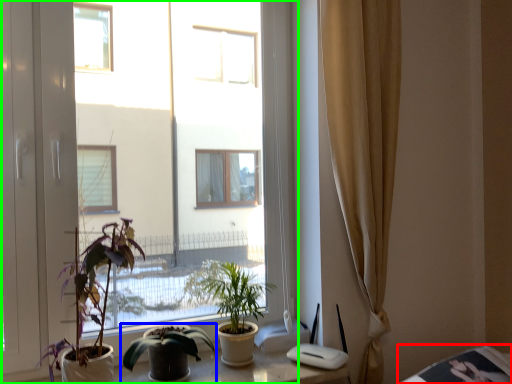
Question: Which object is positioned closest to table (highlighted by a red box)? Select from houseplant (highlighted by a blue box) and window (highlighted by a green box).

Choices:
 (A) houseplant
 (B) window

Answer: (A)